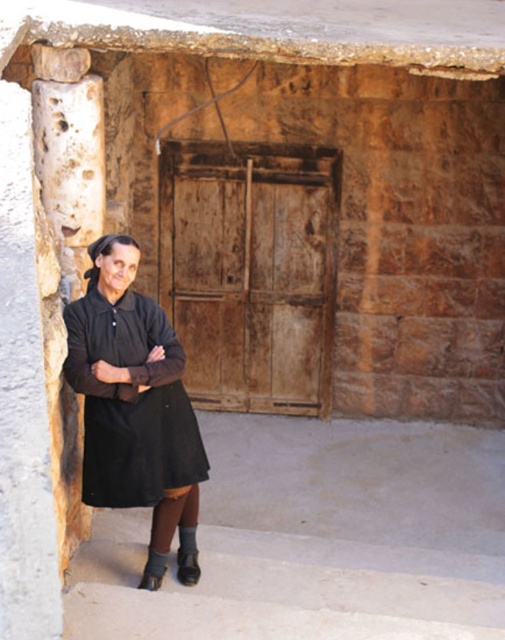
You are a photographer taking a picture of the elderly woman in front of the rustic wooden door. You notice two points on the door marked as point 1 at coordinates (209,275) and point 2 at coordinates (188,413). Which point is closer to the camera?

Point 1 at coordinates (209,275) is closer to the camera than point 2 at coordinates (188,413) because it is further to the camera than point 2.

You are standing at a point and want to reach the rustic wooden door behind the elderly woman. The point you are currently at is marked as point [191,540]. If you need to walk 15 feet to reach the door, will you be able to reach it from your current position?

The distance between point [191,540] and the viewer is 16.21 feet. Since you need to walk 15 feet to reach the door, you will not be able to reach it from your current position as the required distance is shorter than the actual distance.